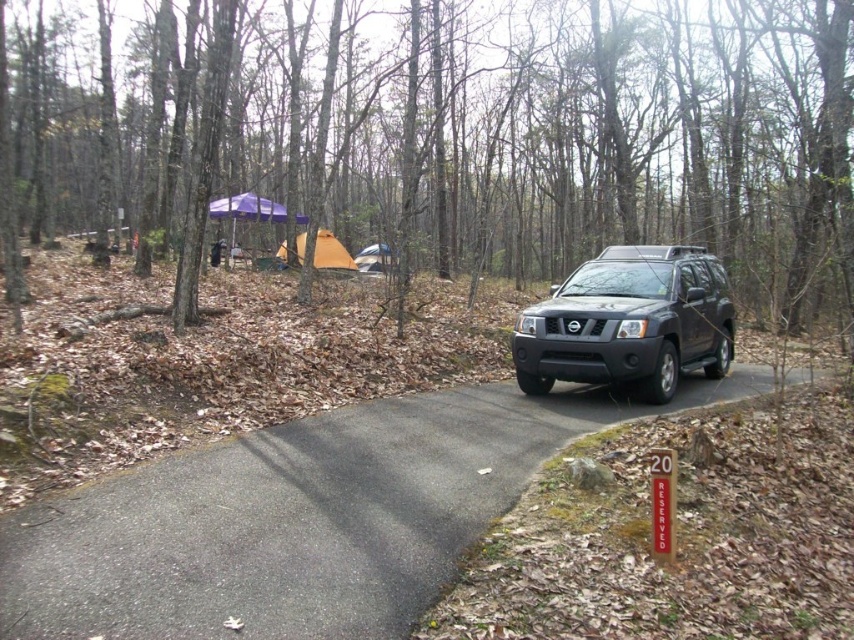
Question: Does brown bark tree at center have a lesser width compared to orange canvas tent at center?

Choices:
 (A) no
 (B) yes

Answer: (A)

Question: Among these points, which one is nearest to the camera?

Choices:
 (A) (379, 257)
 (B) (358, 444)
 (C) (583, 316)
 (D) (302, 248)

Answer: (B)

Question: Which point is closer to the camera taking this photo?

Choices:
 (A) (598, 410)
 (B) (361, 269)
 (C) (170, 26)

Answer: (A)

Question: Is black matte suv at center positioned behind orange canvas tent at center?

Choices:
 (A) yes
 (B) no

Answer: (B)

Question: Observing the image, what is the correct spatial positioning of brown bark tree at center in reference to black matte suv at center?

Choices:
 (A) below
 (B) above

Answer: (B)

Question: Which of the following is the farthest from the observer?

Choices:
 (A) (659, 384)
 (B) (132, 502)

Answer: (A)